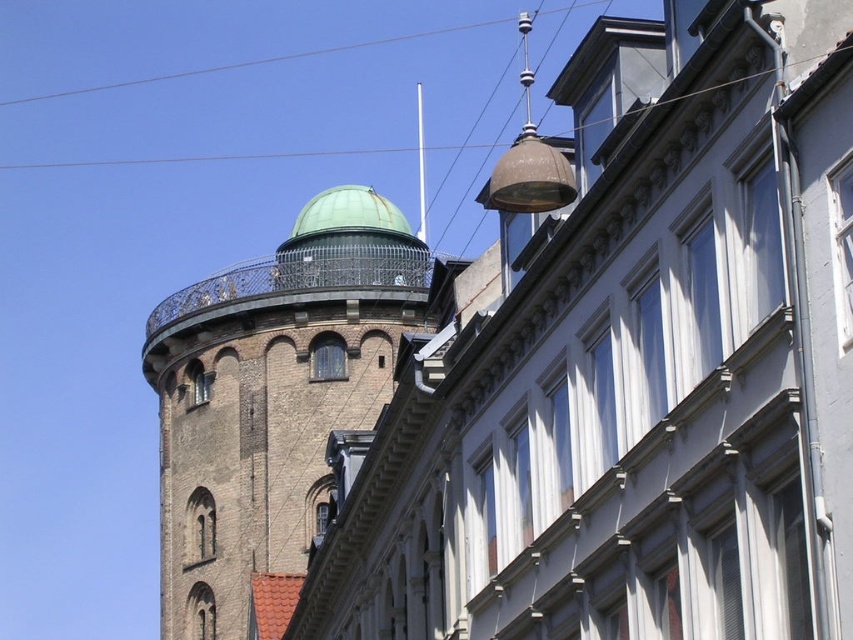
What are the coordinates of the green copper dome at upper left?

The green copper dome at upper left is located at coordinates point (271,397).

You are an architect assessing the structural integrity of the green copper dome at upper center and the clear wire at upper center. Which object has a smaller width?

The green copper dome at upper center has a smaller width than the clear wire at upper center according to the description.

You are standing at a point where you can see both the historic round tower and the modern rectangular building. There are two points marked on the ground. The first point is at coordinates point (x=302, y=524), and the second point is at coordinates point (x=38, y=97). If you want to move from the first point to the second point, which direction should you walk relative to the buildings?

You should walk towards the historic round tower on the left because point (x=302, y=524) is in front of point (x=38, y=97), meaning the second point is closer to the tower.